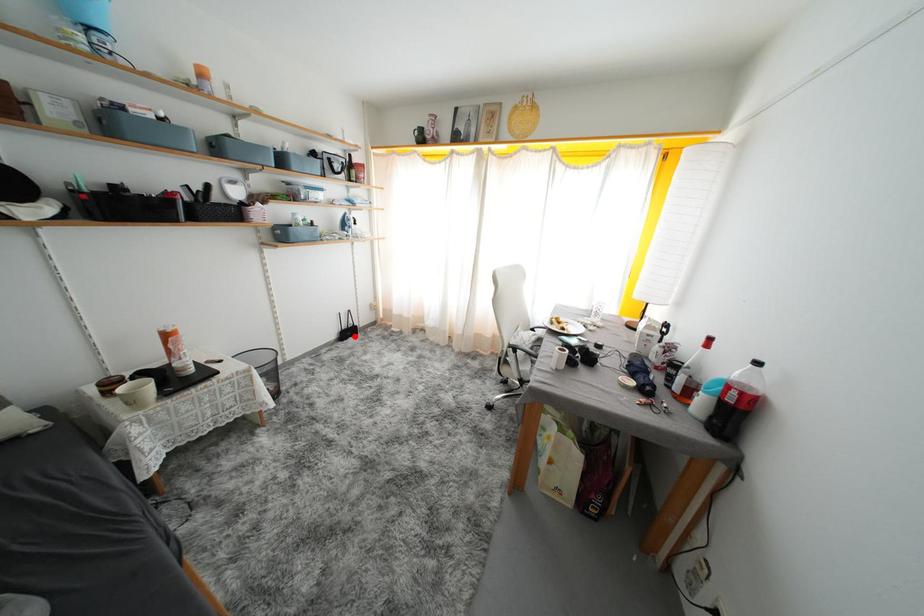
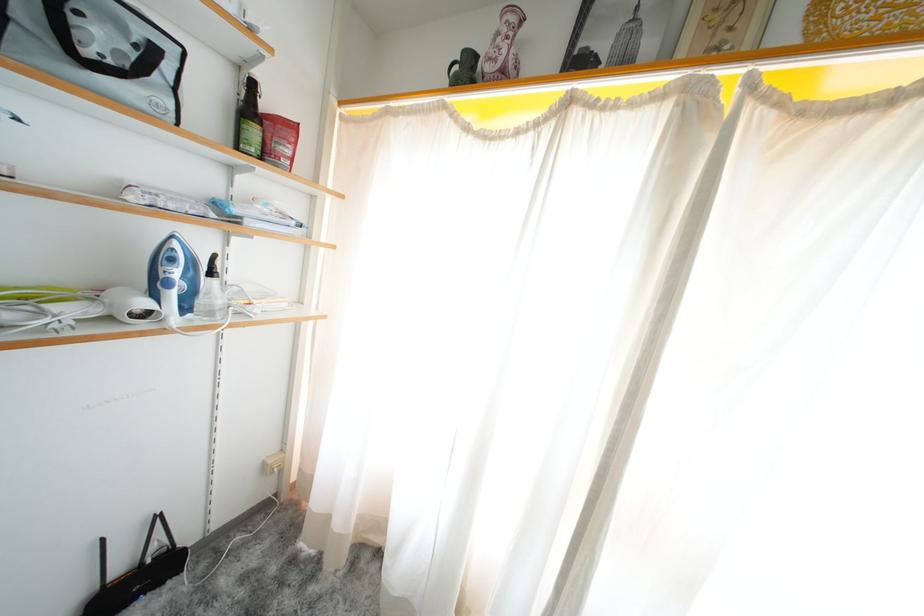
Question: I am providing you with two images of the same scene from different viewpoints. Image1 has a red point marked. In image2, the corresponding 3D location appears at what relative position? Reply with the corresponding letter.

Choices:
 (A) Closer
 (B) Farther

Answer: (A)